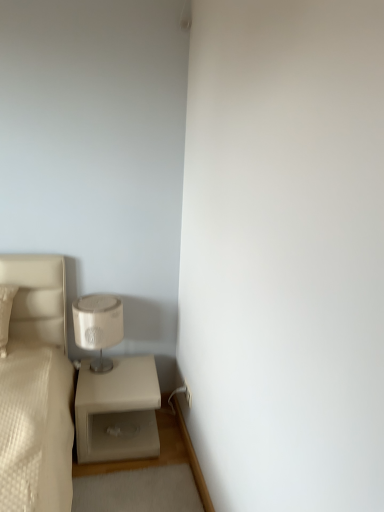
This screenshot has height=512, width=384. What are the coordinates of `free space above beige matte nightstand at lower left (from a real-world perspective)` in the screenshot? It's located at (127, 374).